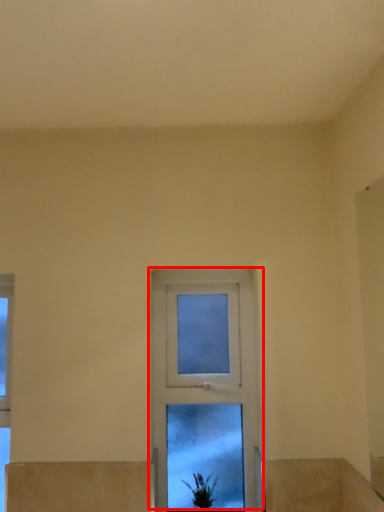
Question: From the image, what is the correct spatial relationship of window (annotated by the red box) in relation to houseplant?

Choices:
 (A) right
 (B) left

Answer: (A)